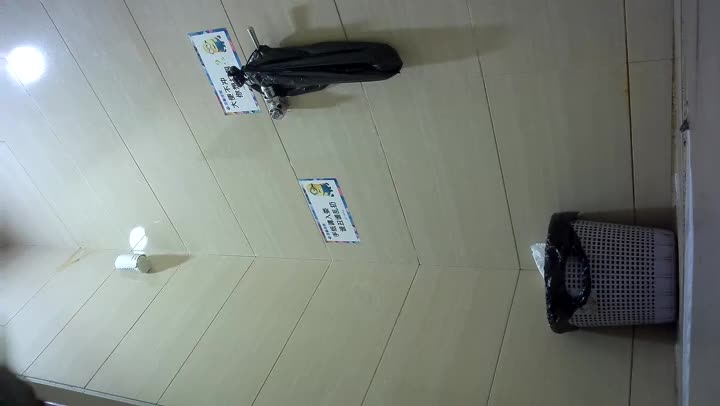
What are the coordinates of `trash` in the screenshot? It's located at (536, 255).